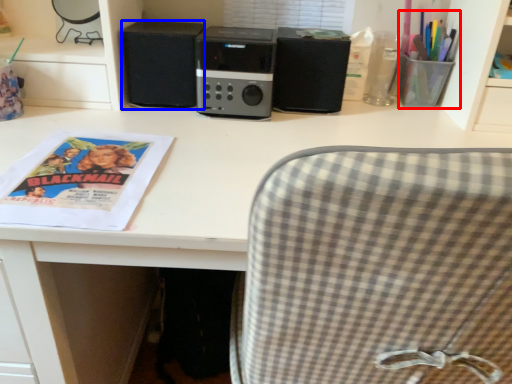
Question: Which object is further to the camera taking this photo, stationery (highlighted by a red box) or speaker (highlighted by a blue box)?

Choices:
 (A) stationery
 (B) speaker

Answer: (B)